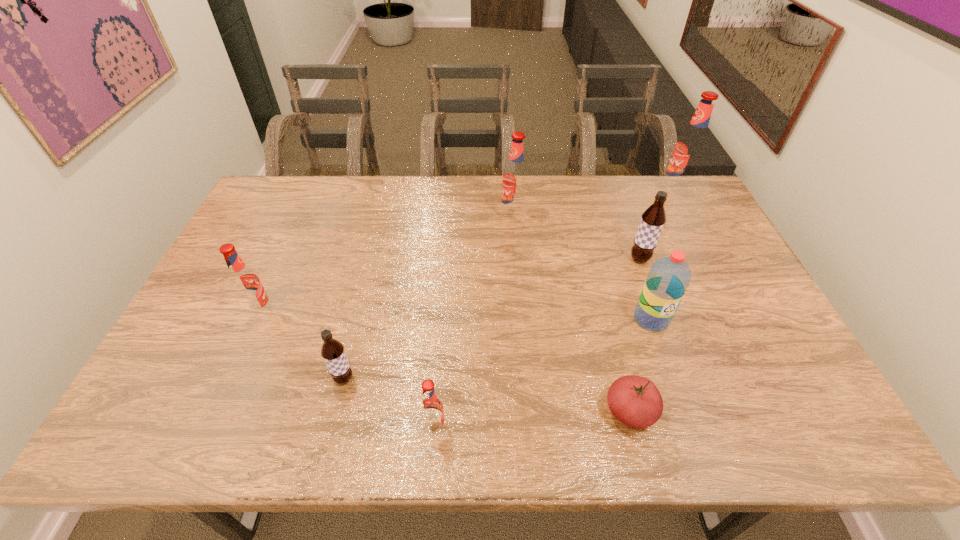
At what (x,y) coordinates should I click in order to perform the action: click on the rightmost root beer. Please return your answer as a coordinate pair (x, y). The width and height of the screenshot is (960, 540). Looking at the image, I should click on (690, 148).

You are a GUI agent. You are given a task and a screenshot of the screen. Output one action in this format:
    pyautogui.click(x=<x>, y=<y>)
    Task: Click on the farthest red root beer
    The width and height of the screenshot is (960, 540).
    Given the screenshot: What is the action you would take?
    pyautogui.click(x=690, y=148)

Identify the location of the seventh nearest object. (515, 177).

Image resolution: width=960 pixels, height=540 pixels. I want to click on the third red root beer from left to right, so click(x=515, y=177).

At what (x,y) coordinates should I click in order to perform the action: click on the farther brown root beer. Please return your answer as a coordinate pair (x, y). This screenshot has width=960, height=540. Looking at the image, I should click on (653, 219).

The image size is (960, 540). I want to click on the right brown root beer, so click(x=653, y=219).

At what (x,y) coordinates should I click in order to perform the action: click on the fourth farthest root beer. Please return your answer as a coordinate pair (x, y). Image resolution: width=960 pixels, height=540 pixels. Looking at the image, I should click on (245, 283).

Identify the location of the leftmost root beer. (245, 283).

The image size is (960, 540). Identify the location of red water bottle. (668, 279).

Where is `the nearest red root beer`? The width and height of the screenshot is (960, 540). the nearest red root beer is located at coordinates (431, 409).